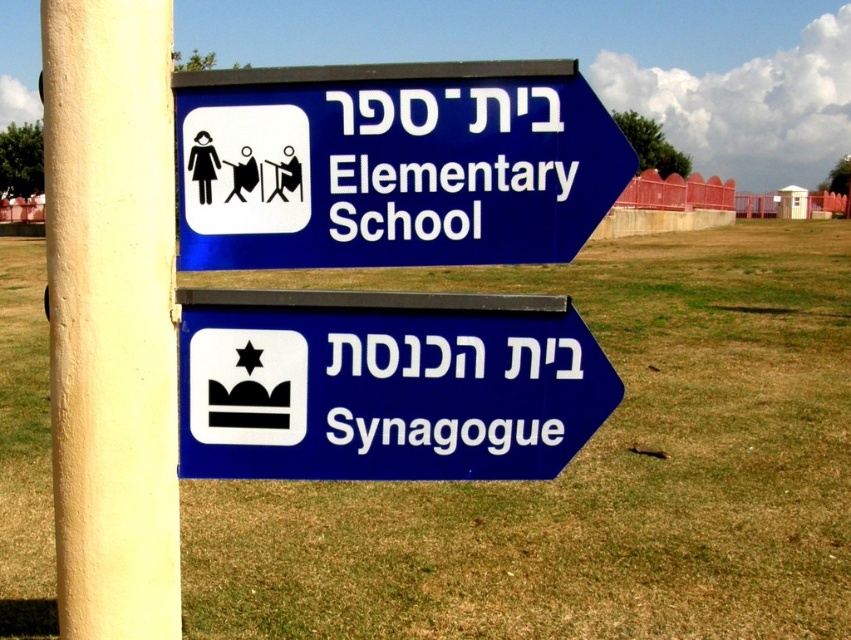
You are a tourist in a new city and see the two blue plastic signs on a pole. The signs are labeled as the blue plastic elementary school sign at upper right and the blue plastic sign at lower right. Which of these two signs is bigger?

The blue plastic elementary school sign at upper right is larger than the blue plastic sign at lower right.

You are a visitor at a park and see the white textured pole at left and the blue plastic sign at lower right. Which object is bigger in size?

The white textured pole at left has a larger size compared to the blue plastic sign at lower right.

Based on the photo, you are a tourist holding a map and looking at the white textured pole at left and the blue plastic sign at lower right. Which object is located to the left of the other?

The white textured pole at left is positioned on the left side of blue plastic sign at lower right, so the white textured pole at left is to the left of the blue plastic sign at lower right.